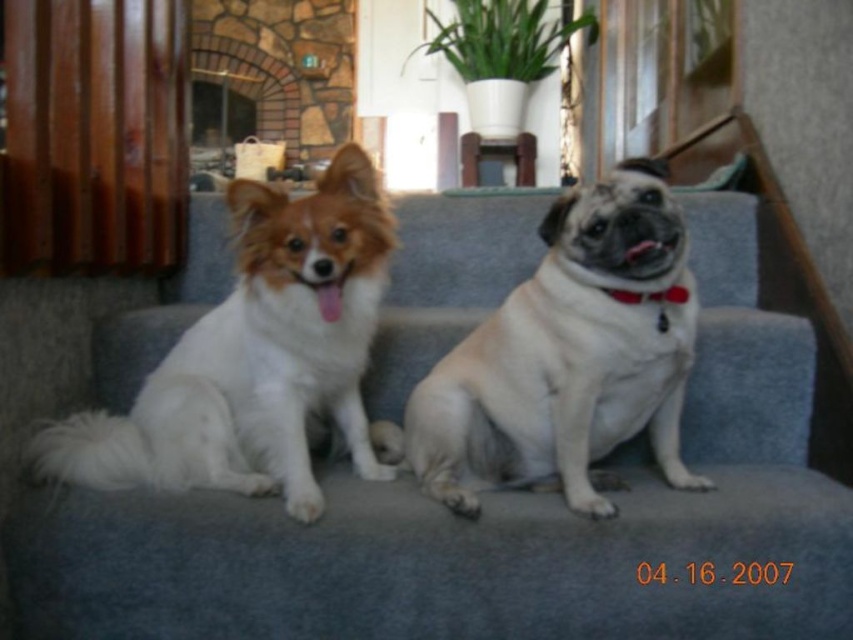
Question: Is white fluffy dog at left to the right of white fur dog at center from the viewer's perspective?

Choices:
 (A) yes
 (B) no

Answer: (B)

Question: Which point is closer to the camera?

Choices:
 (A) (608, 294)
 (B) (602, 211)
 (C) (120, 369)

Answer: (B)

Question: Which of these objects is positioned closest to the white fur dog at center?

Choices:
 (A) white fluffy dog at left
 (B) white fabric neckband at center

Answer: (B)

Question: Which object is positioned farthest from the white fabric neckband at center?

Choices:
 (A) white fluffy dog at left
 (B) gray fabric couch at center
 (C) white fur dog at center

Answer: (A)

Question: Can you confirm if white fluffy dog at left is positioned above white fabric neckband at center?

Choices:
 (A) yes
 (B) no

Answer: (B)

Question: Is white fluffy dog at left positioned before white fabric neckband at center?

Choices:
 (A) no
 (B) yes

Answer: (B)